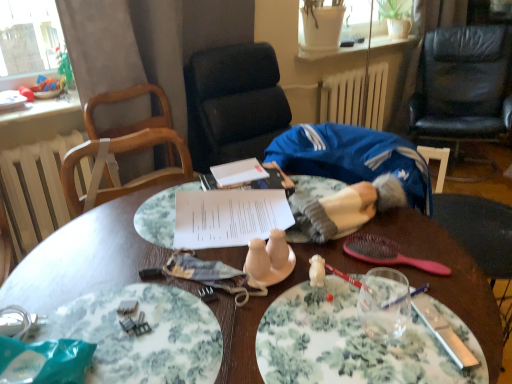
Locate an element on the screen. This screenshot has width=512, height=384. vacant space behind silver metallic knife at lower right is located at coordinates (409, 274).